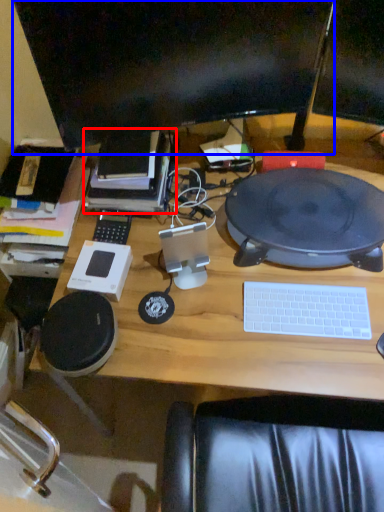
Question: Which object appears farthest to the camera in this image, book (highlighted by a red box) or computer monitor (highlighted by a blue box)?

Choices:
 (A) book
 (B) computer monitor

Answer: (A)